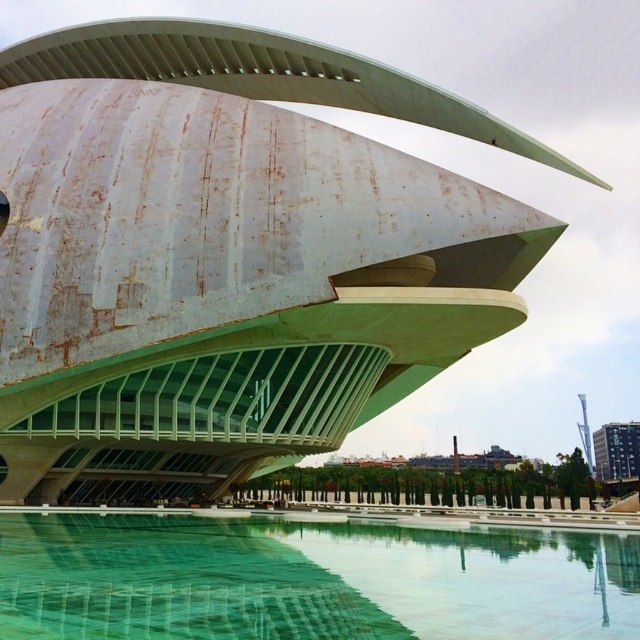
What do you see at coordinates (228, 253) in the screenshot? The image size is (640, 640). I see `white matte building at center` at bounding box center [228, 253].

Describe the element at coordinates (228, 253) in the screenshot. I see `white matte building at center` at that location.

Where is `white matte building at center`? The width and height of the screenshot is (640, 640). white matte building at center is located at coordinates (228, 253).